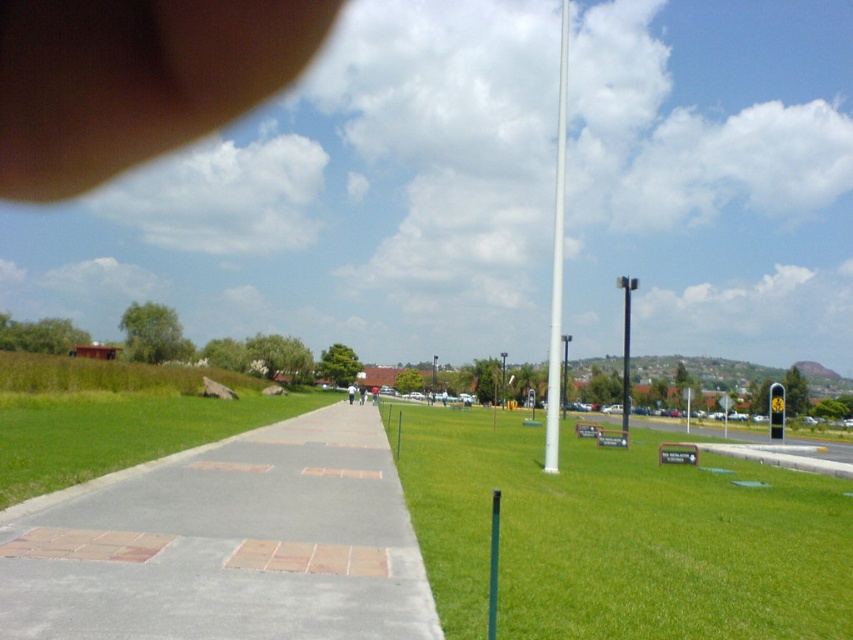
You are a maintenance worker assigned to check the gray concrete sidewalk at lower left and the white glossy pole at center. Which object requires more attention if the smaller one needs immediate inspection?

The gray concrete sidewalk at lower left requires more attention because it is smaller and needs immediate inspection.

You are a gardener planning to mow the lawn. You see the green grass at center and the gray concrete sidewalk at lower left. Which area should you avoid mowing?

The gray concrete sidewalk at lower left is a concrete structure and should be avoided during mowing. The green grass at center is the area intended for mowing.

You are standing at a point in a park and want to reach a specific location marked by point (688, 512). If your walking speed is 1.5 meters per second, how many seconds will it take you to reach that point?

The distance between you and point (688, 512) is 12.16 meters. At a speed of 1.5 meters per second, it will take approximately 8.11 seconds to reach the point.